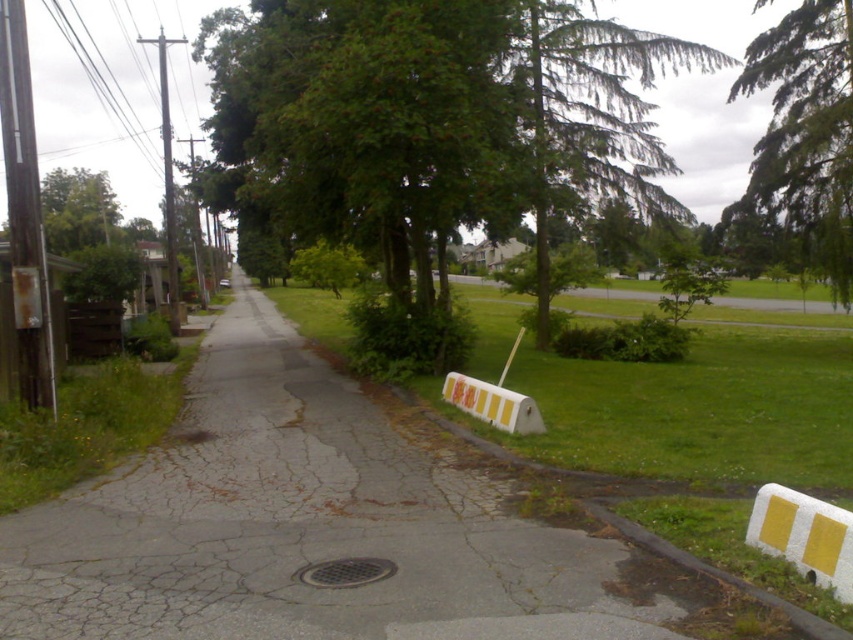
You are a city planner assessing the suburban street scene. You need to determine if the green leafy tree at center can be trimmed to fit within the space allocated for the yellow matte barricade at center. Can the tree be trimmed to fit within the barricade area?

The green leafy tree at center is wider than the yellow matte barricade at center. Trimming the tree to fit within the barricade area would be necessary as its current width exceeds the barricade.

From the picture: You are a pedestrian standing on the suburban street and see the green leafy tree at center and the yellow matte barricade at center. Which object is closer to your left side?

The green leafy tree at center is closer to your left side because it is positioned to the left of the yellow matte barricade at center.